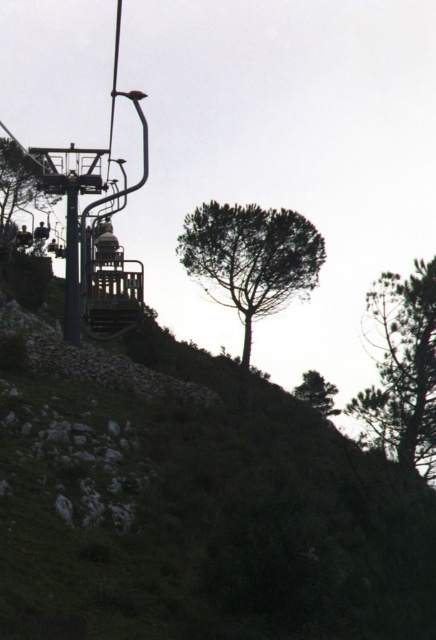
Question: Is green textured tree at upper right thinner than metallic gray ski lift at left?

Choices:
 (A) no
 (B) yes

Answer: (B)

Question: Which point is farther to the camera?

Choices:
 (A) (17, 163)
 (B) (314, 381)
 (C) (429, 452)
 (D) (112, 116)

Answer: (D)

Question: Does green leafy tree at center lie in front of green leafy tree at upper center?

Choices:
 (A) yes
 (B) no

Answer: (A)

Question: Which of the following is the farthest from the observer?

Choices:
 (A) green textured tree at upper right
 (B) metallic gray ski lift at left
 (C) green matte tree at lower center

Answer: (C)

Question: Is green textured tree at upper right bigger than green matte tree at lower center?

Choices:
 (A) no
 (B) yes

Answer: (B)

Question: Which object is the closest to the green matte tree at lower center?

Choices:
 (A) green leafy tree at upper center
 (B) metallic gray ski lift at left
 (C) green textured tree at upper right

Answer: (A)